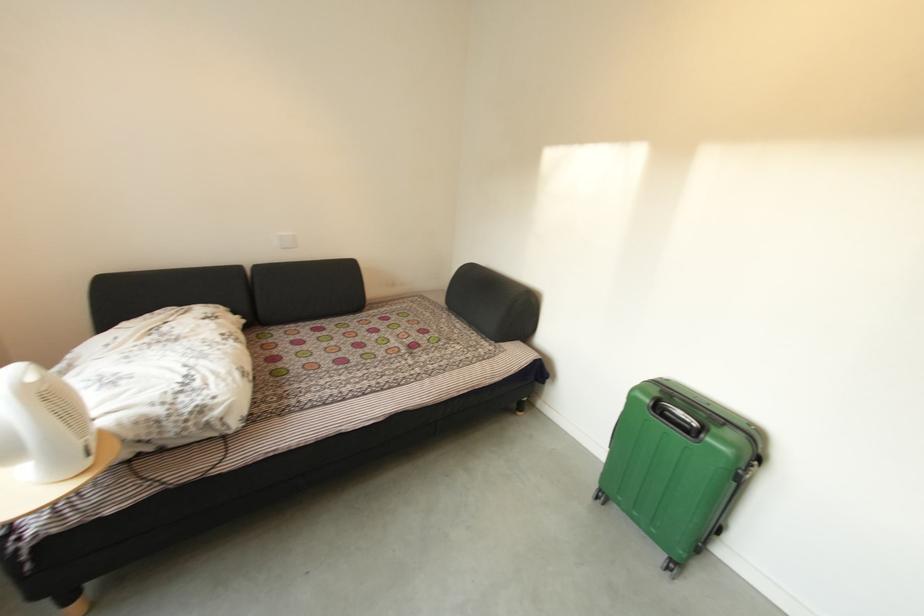
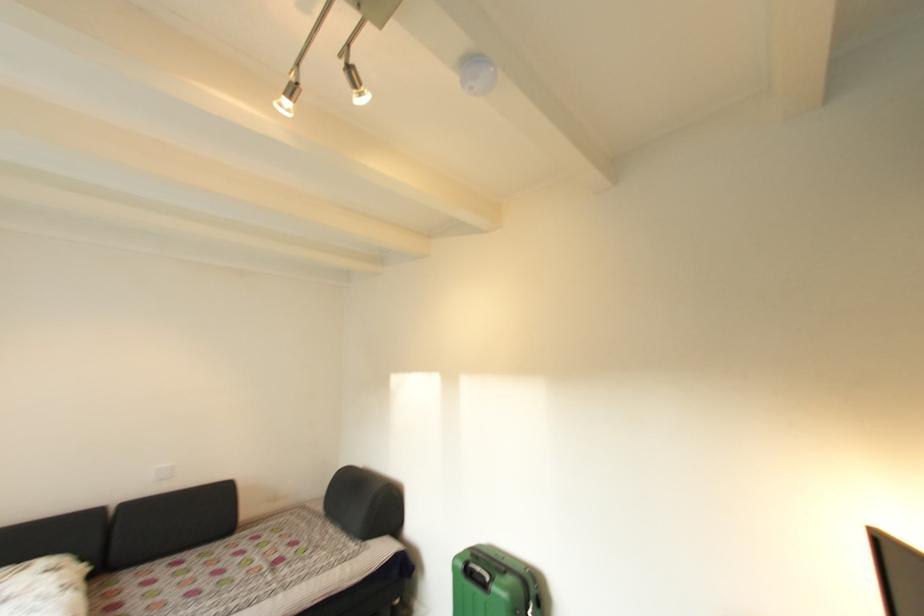
Where in the second image is the point corresponding to (470,328) from the first image?

(344, 533)